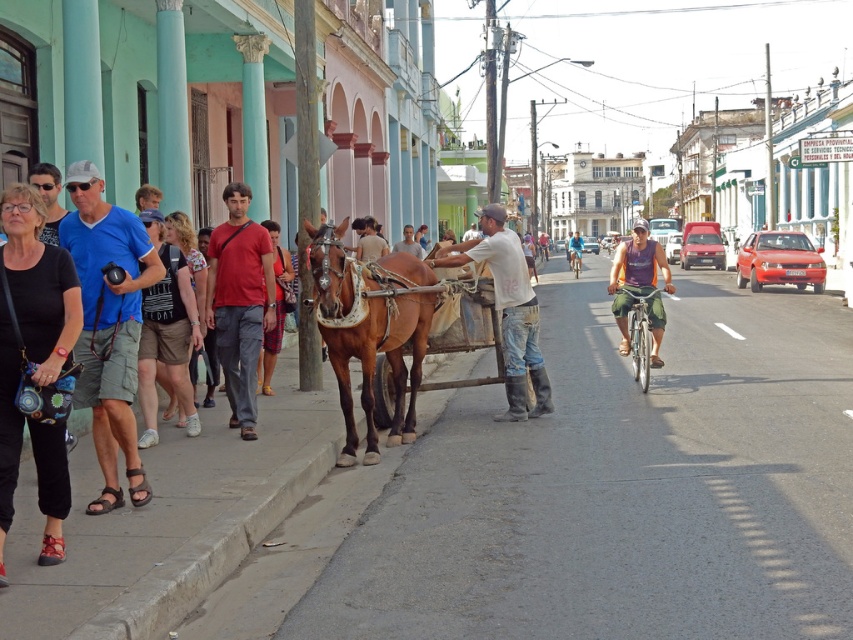
Question: Does brown leather horse at center appear on the left side of purple fabric shirt at center?

Choices:
 (A) yes
 (B) no

Answer: (A)

Question: Which is nearer to the brown leather horse at center?

Choices:
 (A) blue cotton shirt at left
 (B) purple fabric shirt at center
 (C) matte red shirt at center
 (D) white cotton shirt at center

Answer: (C)

Question: Which object is farther from the camera taking this photo?

Choices:
 (A) brown leather horse at center
 (B) white cotton shirt at center

Answer: (B)

Question: Which is farther from the purple fabric shirt at center?

Choices:
 (A) blue cotton shirt at left
 (B) matte red shirt at center
 (C) white cotton shirt at center
 (D) brown leather horse at center

Answer: (A)

Question: From the image, what is the correct spatial relationship of blue cotton shirt at left in relation to matte red shirt at center?

Choices:
 (A) above
 (B) below

Answer: (B)

Question: Does brown leather horse at center have a greater width compared to matte red shirt at center?

Choices:
 (A) no
 (B) yes

Answer: (B)